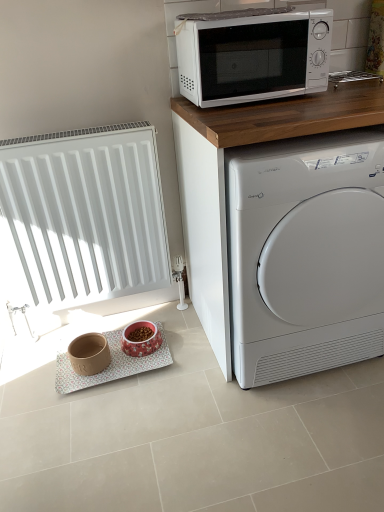
Question: In terms of width, does matte brown bowl at lower left, the 1th appliance when ordered from left to right, look wider or thinner when compared to white matte radiator at left?

Choices:
 (A) wide
 (B) thin

Answer: (A)

Question: Is point (105, 354) positioned closer to the camera than point (59, 194)?

Choices:
 (A) closer
 (B) farther

Answer: (B)

Question: Considering the real-world distances, which object is closest to the white glossy microwave at upper center?

Choices:
 (A) white matte radiator at left
 (B) matte brown bowl at lower left, the 1th appliance when ordered from left to right
 (C) pink glossy bowl at lower center, the 2th appliance viewed from the left
 (D) white glossy washing machine at right

Answer: (D)

Question: Which of these objects is positioned farthest from the white matte radiator at left?

Choices:
 (A) white glossy washing machine at right
 (B) white glossy microwave at upper center
 (C) pink glossy bowl at lower center, the first appliance viewed from the right
 (D) matte brown bowl at lower left, marked as the 2th appliance in a right-to-left arrangement

Answer: (A)